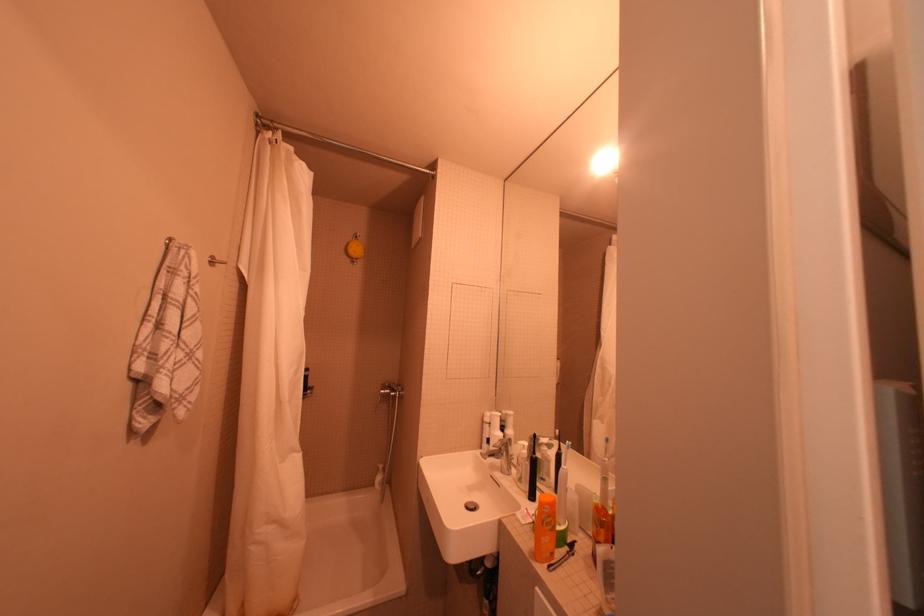
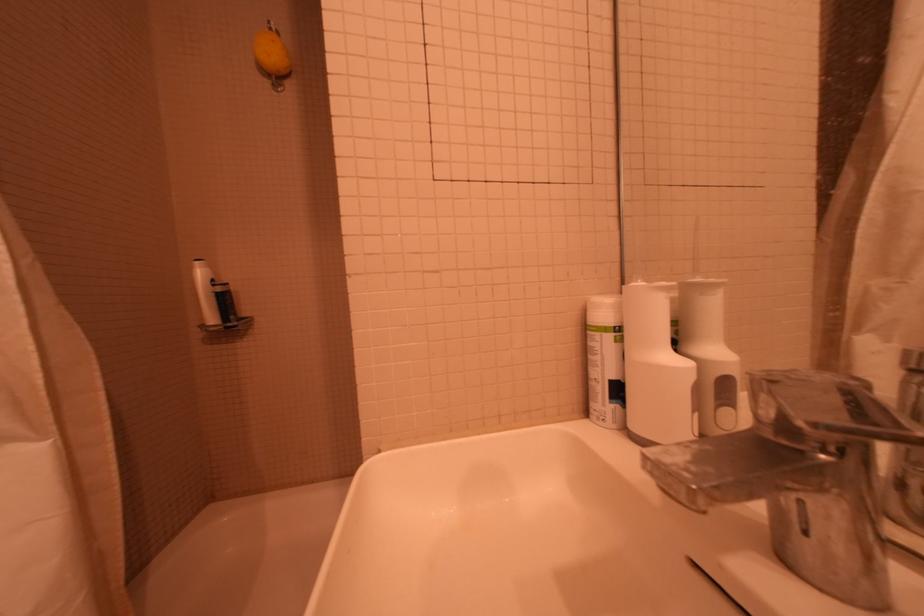
Find the pixel in the second image that matches pixel 499 419 in the first image.

(627, 309)